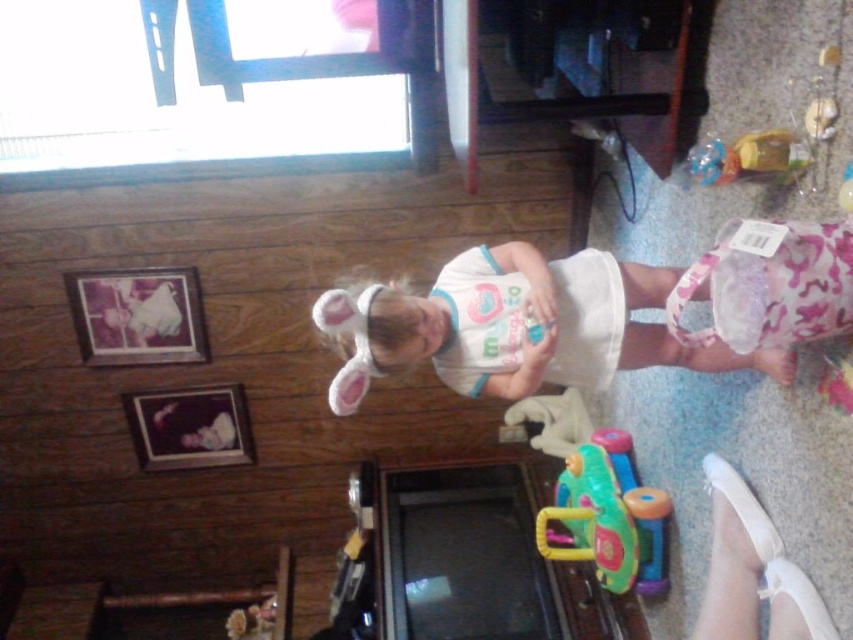
Question: Among these objects, which one is farthest from the camera?

Choices:
 (A) white fabric dress at center
 (B) rubberized plastic toy car at lower center

Answer: (B)

Question: Which of the following is the farthest from the observer?

Choices:
 (A) (735, 362)
 (B) (624, 452)

Answer: (B)

Question: Which point is closer to the camera?

Choices:
 (A) (567, 481)
 (B) (578, 275)

Answer: (B)

Question: Is white fabric dress at center wider than rubberized plastic toy car at lower center?

Choices:
 (A) no
 (B) yes

Answer: (B)

Question: From the image, what is the correct spatial relationship of white fabric dress at center in relation to rubberized plastic toy car at lower center?

Choices:
 (A) above
 (B) below

Answer: (A)

Question: Can you confirm if white fabric dress at center is smaller than rubberized plastic toy car at lower center?

Choices:
 (A) no
 (B) yes

Answer: (A)